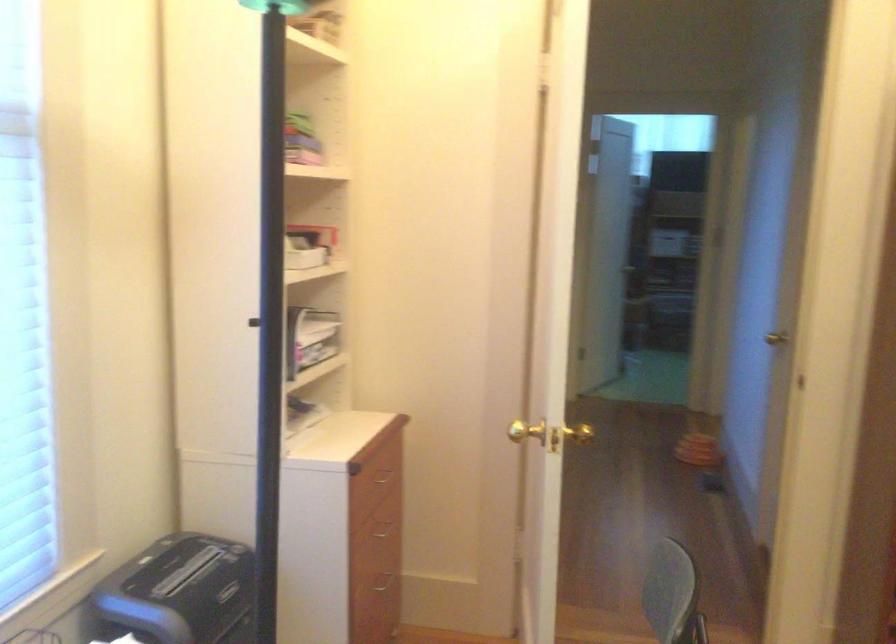
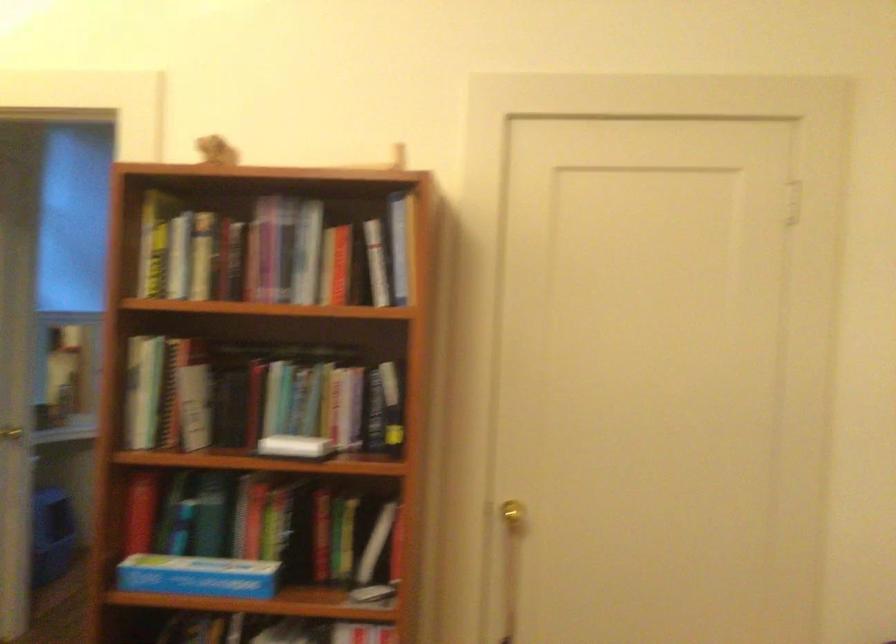
Question: In a continuous first-person perspective shot, in which direction is the camera moving?

Choices:
 (A) Left
 (B) Right
 (C) Forward
 (D) Backward

Answer: (B)